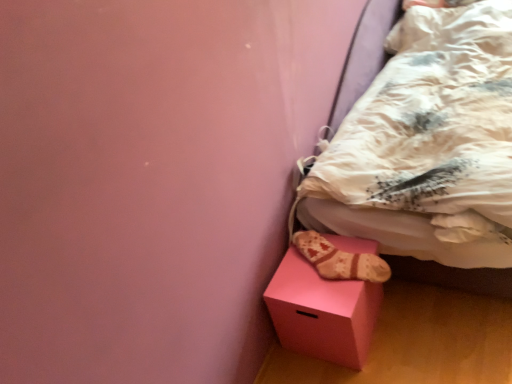
Question: Is white textured bed at lower right bigger than pink matte cube at lower right?

Choices:
 (A) no
 (B) yes

Answer: (B)

Question: Is white textured bed at lower right shorter than pink matte cube at lower right?

Choices:
 (A) yes
 (B) no

Answer: (B)

Question: Is the depth of white textured bed at lower right less than that of pink matte cube at lower right?

Choices:
 (A) yes
 (B) no

Answer: (A)

Question: Is white textured bed at lower right positioned with its back to pink matte cube at lower right?

Choices:
 (A) yes
 (B) no

Answer: (B)

Question: From the image's perspective, does white textured bed at lower right appear higher than pink matte cube at lower right?

Choices:
 (A) no
 (B) yes

Answer: (B)

Question: Is point (348, 240) closer or farther from the camera than point (325, 177)?

Choices:
 (A) closer
 (B) farther

Answer: (B)

Question: Is pink matte cube at lower right inside or outside of white textured bed at lower right?

Choices:
 (A) inside
 (B) outside

Answer: (B)

Question: Based on their sizes in the image, would you say pink matte cube at lower right is bigger or smaller than white textured bed at lower right?

Choices:
 (A) big
 (B) small

Answer: (B)

Question: Is pink matte cube at lower right in front of or behind white textured bed at lower right in the image?

Choices:
 (A) front
 (B) behind

Answer: (B)

Question: Considering the positions of white textured bed at lower right and beige fabric sock at lower right in the image, is white textured bed at lower right bigger or smaller than beige fabric sock at lower right?

Choices:
 (A) small
 (B) big

Answer: (B)

Question: Considering the positions of white textured bed at lower right and beige fabric sock at lower right in the image, is white textured bed at lower right wider or thinner than beige fabric sock at lower right?

Choices:
 (A) wide
 (B) thin

Answer: (A)

Question: From the image's perspective, is white textured bed at lower right located above or below beige fabric sock at lower right?

Choices:
 (A) above
 (B) below

Answer: (A)

Question: Is point (489, 264) closer or farther from the camera than point (308, 231)?

Choices:
 (A) closer
 (B) farther

Answer: (A)

Question: Is white textured bed at lower right to the left or to the right of pink matte cube at lower right in the image?

Choices:
 (A) left
 (B) right

Answer: (B)

Question: Considering the positions of white textured bed at lower right and pink matte cube at lower right in the image, is white textured bed at lower right taller or shorter than pink matte cube at lower right?

Choices:
 (A) tall
 (B) short

Answer: (A)